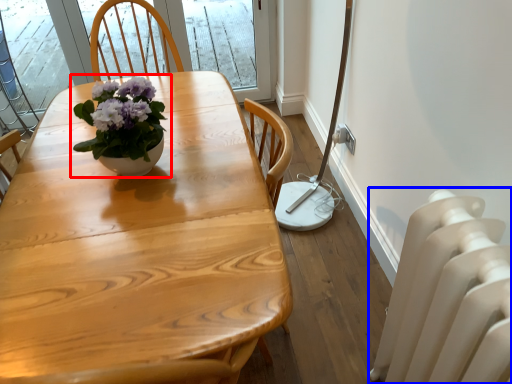
Question: Which object appears closest to the camera in this image, houseplant (highlighted by a red box) or radiator (highlighted by a blue box)?

Choices:
 (A) houseplant
 (B) radiator

Answer: (B)